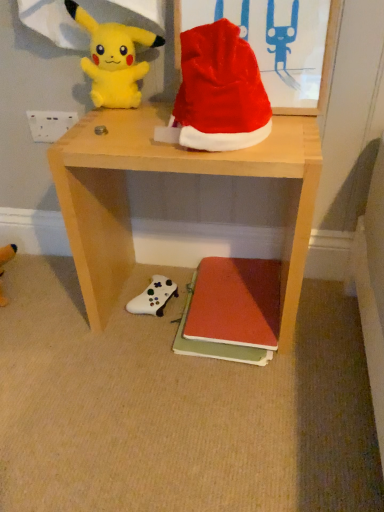
Locate an element on the screen. vacant space to the right of shiny fabric santa hat at upper center is located at coordinates point(294,129).